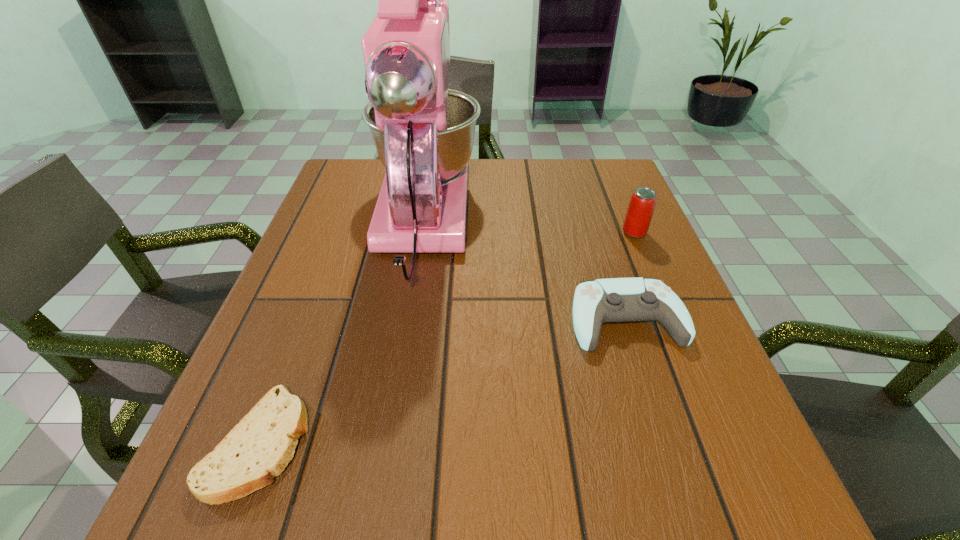
What are the coordinates of `the tallest object` in the screenshot? It's located at (423, 132).

Find the location of a particular element. This screenshot has height=540, width=960. the third shortest object is located at coordinates (643, 200).

This screenshot has height=540, width=960. In order to click on the third tallest object in this screenshot , I will do `click(595, 302)`.

You are a GUI agent. You are given a task and a screenshot of the screen. Output one action in this format:
    pyautogui.click(x=<x>, y=<y>)
    Task: Click on the pita bread
    The height and width of the screenshot is (540, 960).
    Given the screenshot: What is the action you would take?
    pyautogui.click(x=261, y=445)

Find the location of `the nearest object`. the nearest object is located at coordinates (261, 445).

Where is `free space located on the back of the beer can`? The image size is (960, 540). free space located on the back of the beer can is located at coordinates (610, 175).

Locate an element on the screen. Image resolution: width=960 pixels, height=540 pixels. free space located on the left of the second shortest object is located at coordinates (397, 319).

Where is `vacant space located 0.120m on the right of the shortest object`? This screenshot has width=960, height=540. vacant space located 0.120m on the right of the shortest object is located at coordinates (389, 443).

Where is `object positioned at the far edge`? This screenshot has width=960, height=540. object positioned at the far edge is located at coordinates (423, 132).

Identify the location of object that is at the near edge. (261, 445).